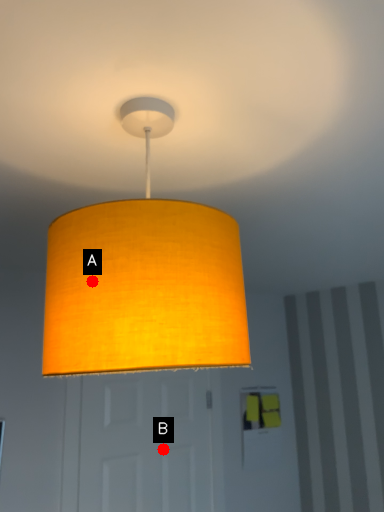
Question: Two points are circled on the image, labeled by A and B beside each circle. Which point is closer to the camera taking this photo?

Choices:
 (A) A is closer
 (B) B is closer

Answer: (A)